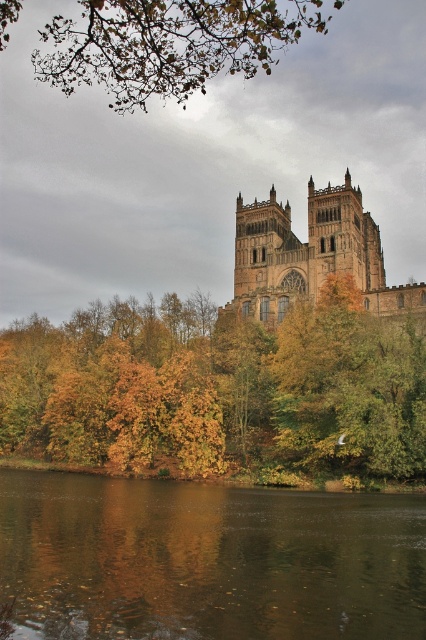
You are standing at the center of the cathedral and want to place a decorative stone exactly where the autumn leaves at center are currently located. According to the image, what are the coordinates where you should place the stone?

The autumn leaves at center are located at coordinates point (218, 388), so you should place the decorative stone there.